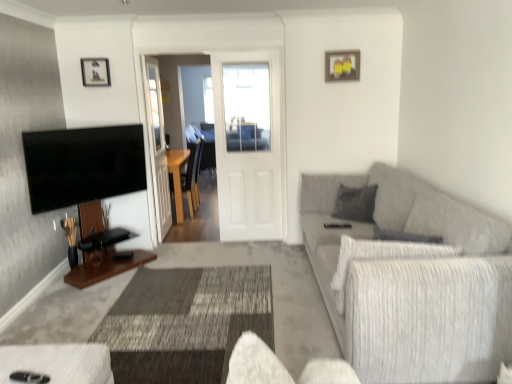
What do you see at coordinates (177, 177) in the screenshot? I see `wooden table at center` at bounding box center [177, 177].

At what (x,y) coordinates should I click in order to perform the action: click on wooden table at center. Please return your answer as a coordinate pair (x, y). Looking at the image, I should click on (177, 177).

Measure the distance between point (102,69) and camera.

They are 4.08 meters apart.

At what (x,y) coordinates should I click in order to perform the action: click on wooden picture frame at upper center, the first picture frame positioned from the right. Please return your answer as a coordinate pair (x, y). The width and height of the screenshot is (512, 384). Looking at the image, I should click on (342, 65).

Measure the distance between transparent glass door at center and camera.

They are 4.13 meters apart.

In order to click on wooden table at center in this screenshot , I will do `click(177, 177)`.

Is transparent glass door at center bigger or smaller than wooden picture frame at upper center, the 1th picture frame from the left?

Considering their sizes, transparent glass door at center takes up more space than wooden picture frame at upper center, the 1th picture frame from the left.

Which of these two, transparent glass door at center or wooden picture frame at upper center, the 1th picture frame from the left, stands taller?

With more height is transparent glass door at center.

The image size is (512, 384). What are the coordinates of `glass door on the right of wooden picture frame at upper center, the 2th picture frame when ordered from right to left` in the screenshot? It's located at (157, 145).

From the image's perspective, is textured gray couch at right over white matte door at center?

No, from the image's perspective, textured gray couch at right is not above white matte door at center.

Is textured gray couch at right located outside white matte door at center?

Yes, textured gray couch at right is located beyond the bounds of white matte door at center.

Is textured gray couch at right not near white matte door at center?

Indeed, textured gray couch at right is not near white matte door at center.

From the picture: Considering the positions of objects textured gray couch at right and white matte door at center in the image provided, who is more to the left, textured gray couch at right or white matte door at center?

Positioned to the left is white matte door at center.

Considering the relative sizes of wooden picture frame at upper center, the first picture frame positioned from the right, and black glossy flat-screen tv at left in the image provided, is wooden picture frame at upper center, the first picture frame positioned from the right, smaller than black glossy flat-screen tv at left?

Correct, wooden picture frame at upper center, the first picture frame positioned from the right, occupies less space than black glossy flat-screen tv at left.

Is wooden picture frame at upper center, the first picture frame positioned from the right, oriented away from black glossy flat-screen tv at left?

No, wooden picture frame at upper center, the first picture frame positioned from the right, is not facing away from black glossy flat-screen tv at left.

Is wooden picture frame at upper center, the 2th picture frame viewed from the left, directly adjacent to black glossy flat-screen tv at left?

wooden picture frame at upper center, the 2th picture frame viewed from the left, is not next to black glossy flat-screen tv at left, and they're not touching.

Considering the points (334, 55) and (60, 161), which point is behind, point (334, 55) or point (60, 161)?

The point (334, 55) is farther from the camera.

Which object is further away from the camera, textured gray couch at right or transparent glass door at center?

transparent glass door at center is behind.

Is textured gray couch at right looking in the opposite direction of transparent glass door at center?

No, textured gray couch at right is not facing away from transparent glass door at center.

Considering the relative sizes of textured gray couch at right and transparent glass door at center in the image provided, is textured gray couch at right thinner than transparent glass door at center?

No.

Can you confirm if transparent glass door at center is wider than wooden table at center?

Incorrect, the width of transparent glass door at center does not surpass that of wooden table at center.

Locate an element on the screen. table that is below the transparent glass door at center (from the image's perspective) is located at coordinates (177, 177).

Is transparent glass door at center far away from wooden table at center?

transparent glass door at center is actually quite close to wooden table at center.

From a real-world perspective, is wooden picture frame at upper center, the 2th picture frame when ordered from right to left, over textured gray couch at right?

Yes, from a real-world perspective, wooden picture frame at upper center, the 2th picture frame when ordered from right to left, is over textured gray couch at right

Considering the sizes of objects wooden picture frame at upper center, the 1th picture frame from the left, and textured gray couch at right in the image provided, who is shorter, wooden picture frame at upper center, the 1th picture frame from the left, or textured gray couch at right?

Standing shorter between the two is wooden picture frame at upper center, the 1th picture frame from the left.

From the image's perspective, who appears lower, wooden picture frame at upper center, the 2th picture frame when ordered from right to left, or textured gray couch at right?

textured gray couch at right is shown below in the image.

Is wooden picture frame at upper center, the 1th picture frame from the left, wider than textured gray couch at right?

No.

Which point is more forward, [103,73] or [59,156]?

The point [59,156] is in front.

Can you confirm if wooden picture frame at upper center, the 1th picture frame from the left, is shorter than black glossy flat-screen tv at left?

Indeed, wooden picture frame at upper center, the 1th picture frame from the left, has a lesser height compared to black glossy flat-screen tv at left.

Locate an element on the screen. television on the right of wooden picture frame at upper center, the 2th picture frame when ordered from right to left is located at coordinates (83, 165).

How different are the orientations of wooden picture frame at upper center, the 1th picture frame from the left, and black glossy flat-screen tv at left in degrees?

55.2 degrees.

Image resolution: width=512 pixels, height=384 pixels. I want to click on glass door lying behind the wooden picture frame at upper center, the 2th picture frame when ordered from right to left, so click(157, 145).

Where is `studio couch below the white matte door at center (from the image's perspective)`? This screenshot has width=512, height=384. studio couch below the white matte door at center (from the image's perspective) is located at coordinates (411, 280).

Which object lies further to the anchor point textured gray couch at right, black glossy flat-screen tv at left or wooden picture frame at upper center, the 2th picture frame when ordered from right to left?

Based on the image, wooden picture frame at upper center, the 2th picture frame when ordered from right to left, appears to be further to textured gray couch at right.

Estimate the real-world distances between objects in this image. Which object is further from white matte door at center, wooden picture frame at upper center, the 2th picture frame when ordered from right to left, or textured gray couch at right?

wooden picture frame at upper center, the 2th picture frame when ordered from right to left, is further to white matte door at center.

When comparing their distances from textured gray couch at right, does transparent glass door at center or black glossy flat-screen tv at left seem closer?

The object closer to textured gray couch at right is black glossy flat-screen tv at left.

From the picture: Which object lies further to the anchor point wooden table at center, textured gray couch at right or white matte door at center?

The object further to wooden table at center is textured gray couch at right.

From the image, which object appears to be farther from black glossy flat-screen tv at left, textured gray couch at right or transparent glass door at center?

textured gray couch at right.

Considering their positions, is wooden picture frame at upper center, the 1th picture frame from the left, positioned closer to white matte door at center than wooden table at center?

wooden table at center lies closer to white matte door at center than the other object.

When comparing their distances from transparent glass door at center, does white matte door at center or black glossy flat-screen tv at left seem closer?

Among the two, black glossy flat-screen tv at left is located nearer to transparent glass door at center.

Estimate the real-world distances between objects in this image. Which object is closer to black glossy flat-screen tv at left, wooden table at center or wooden picture frame at upper center, the 1th picture frame from the left?

wooden picture frame at upper center, the 1th picture frame from the left, lies closer to black glossy flat-screen tv at left than the other object.

The width and height of the screenshot is (512, 384). Find the location of `door between black glossy flat-screen tv at left and wooden table at center along the z-axis`. door between black glossy flat-screen tv at left and wooden table at center along the z-axis is located at coordinates 250,160.

In order to click on door between wooden picture frame at upper center, the 1th picture frame from the left, and wooden table at center, along the z-axis in this screenshot , I will do `click(250, 160)`.

You are a GUI agent. You are given a task and a screenshot of the screen. Output one action in this format:
    pyautogui.click(x=<x>, y=<y>)
    Task: Click on the glass door between wooden picture frame at upper center, the 2th picture frame when ordered from right to left, and wooden table at center, along the z-axis
    
    Given the screenshot: What is the action you would take?
    pyautogui.click(x=157, y=145)

Where is `glass door between wooden picture frame at upper center, the 2th picture frame when ordered from right to left, and textured gray couch at right from left to right`? The image size is (512, 384). glass door between wooden picture frame at upper center, the 2th picture frame when ordered from right to left, and textured gray couch at right from left to right is located at coordinates (157, 145).